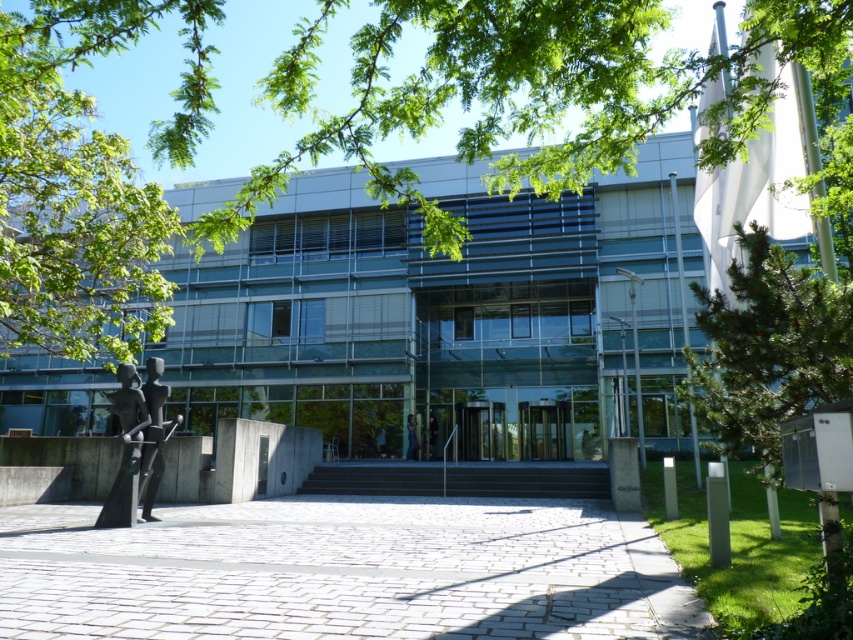
In the scene shown: You are a visitor approaching the building and need to decide whether to walk around the green pine tree at right or go through the transparent glass door at center. Based on their sizes, which option requires less space?

The green pine tree at right occupies less space than the transparent glass door at center, so walking around the green pine tree at right requires less space.